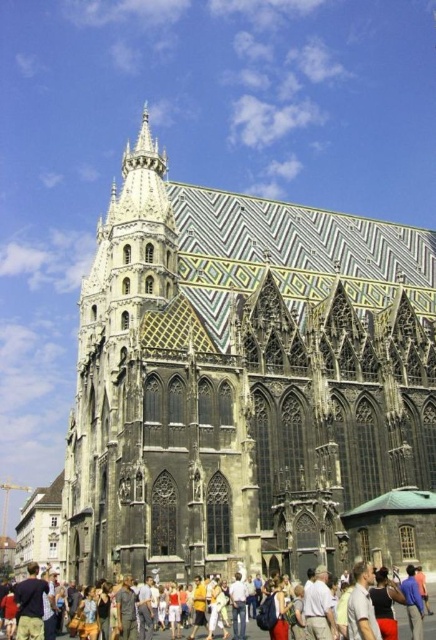
Is multicolored mosaic tile church at center positioned at the back of multicolored fabric crowd at lower center?

Yes.

Does multicolored mosaic tile church at center appear over multicolored fabric crowd at lower center?

Yes.

Who is more distant from viewer, (426, 369) or (248, 630)?

The point (426, 369) is more distant.

Locate an element on the screen. This screenshot has height=640, width=436. multicolored mosaic tile church at center is located at coordinates (241, 378).